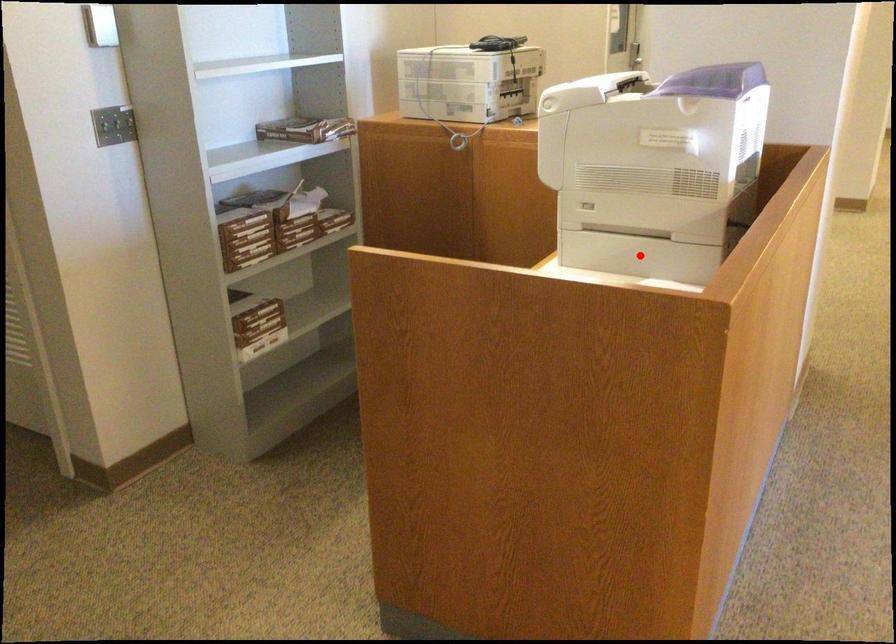
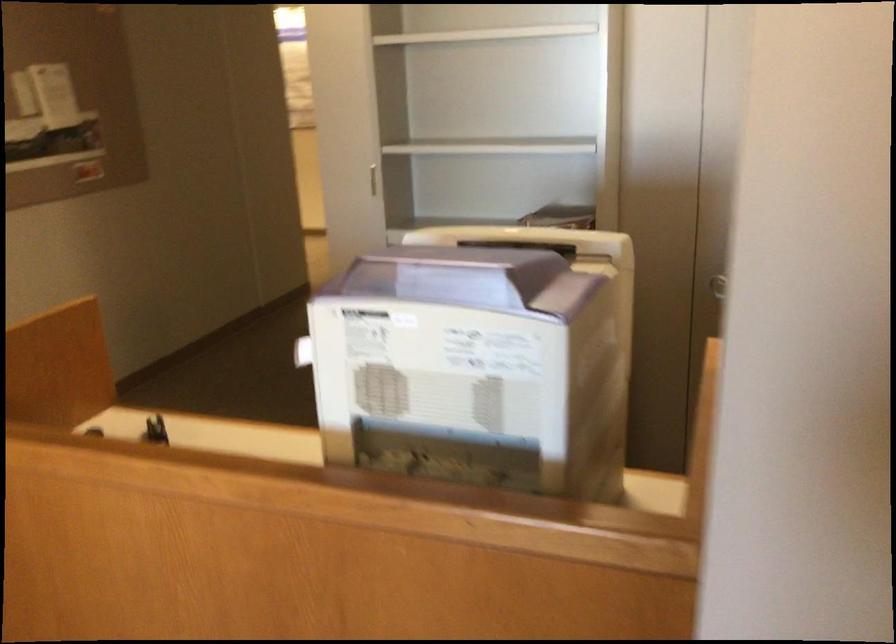
Question: I am providing you with two images of the same scene from different viewpoints. A red point is marked on the first image. Can you still see the location of the red point in image 2?

Choices:
 (A) Yes
 (B) No

Answer: (B)